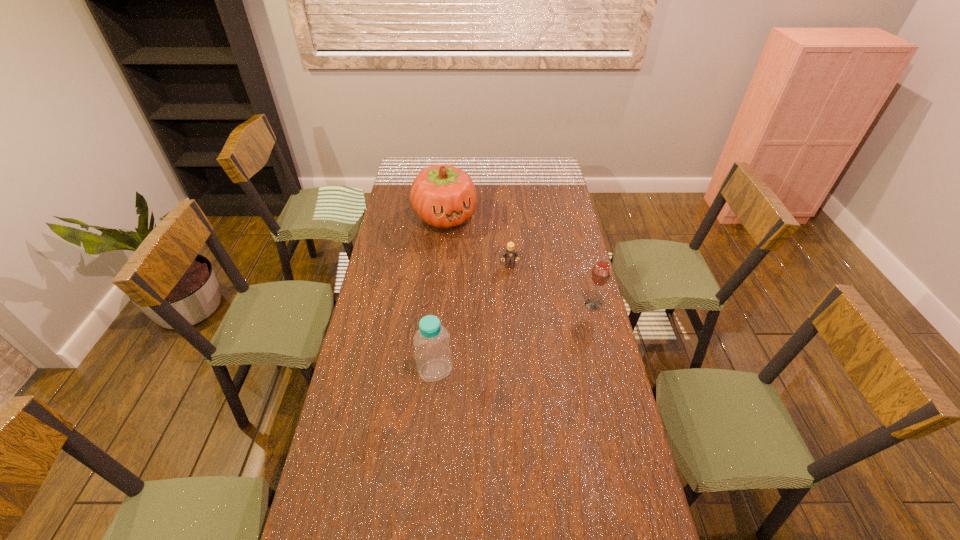
Where is `free space between the pumpkin and the third nearest object`? This screenshot has height=540, width=960. free space between the pumpkin and the third nearest object is located at coordinates (477, 241).

Choose which object is the nearest neighbor to the bottle. Please provide its 2D coordinates. Your answer should be formatted as a tuple, i.e. [(x, y)], where the tuple contains the x and y coordinates of a point satisfying the conditions above.

[(509, 254)]

The image size is (960, 540). Find the location of `object that is the closest one to the third farthest object`. object that is the closest one to the third farthest object is located at coordinates (509, 254).

Image resolution: width=960 pixels, height=540 pixels. In order to click on vacant space that satisfies the following two spatial constraints: 1. on the front side of the pumpkin; 2. on the left side of the Lego in this screenshot , I will do `click(441, 266)`.

Locate an element on the screen. free spot that satisfies the following two spatial constraints: 1. on the front side of the second nearest object; 2. on the left side of the pumpkin is located at coordinates (437, 304).

Locate an element on the screen. The width and height of the screenshot is (960, 540). blank area in the image that satisfies the following two spatial constraints: 1. on the front side of the nearest object; 2. on the left side of the farthest object is located at coordinates (430, 370).